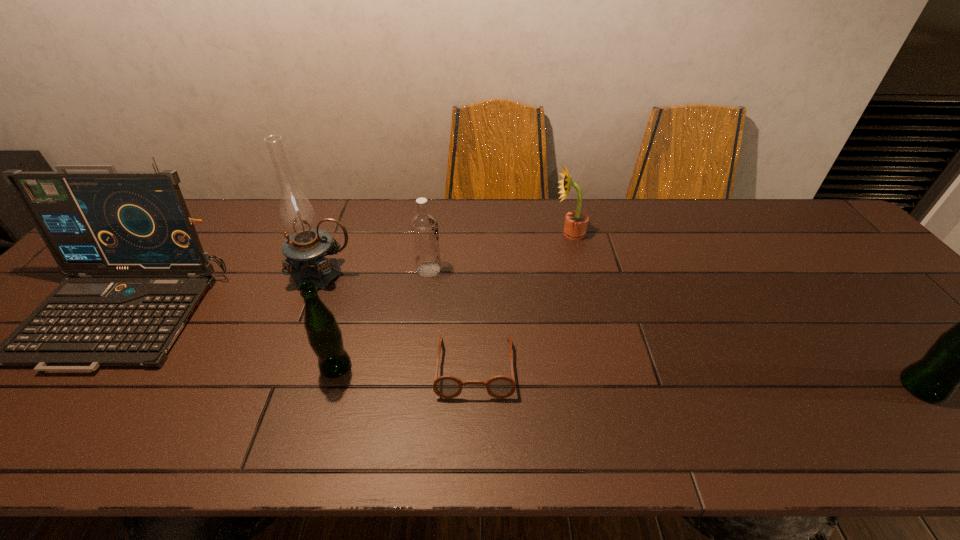
In order to click on the shorter beer bottle in this screenshot , I will do `click(324, 335)`.

Identify the location of the taller beer bottle. Image resolution: width=960 pixels, height=540 pixels. (959, 357).

Where is `the rightmost object`? The height and width of the screenshot is (540, 960). the rightmost object is located at coordinates (959, 357).

Locate an element on the screen. The image size is (960, 540). the second object from right to left is located at coordinates (576, 222).

What are the coordinates of `sunflower` in the screenshot? It's located at (576, 222).

Where is `oil lamp`? The width and height of the screenshot is (960, 540). oil lamp is located at coordinates (304, 249).

The width and height of the screenshot is (960, 540). What are the coordinates of `vodka` in the screenshot? It's located at (424, 227).

Identify the location of spectacles. This screenshot has width=960, height=540. (447, 386).

The image size is (960, 540). I want to click on the third object from right to left, so click(447, 386).

This screenshot has width=960, height=540. I want to click on free space located on the back of the left beer bottle, so [x=362, y=275].